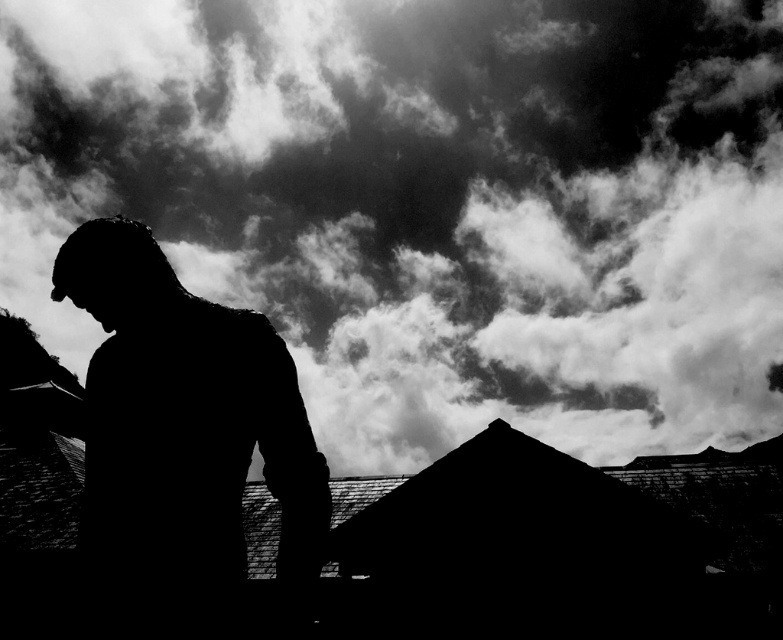
Does cloudy sky at upper center have a lesser height compared to black matte statue at center?

No, cloudy sky at upper center is not shorter than black matte statue at center.

Find the location of a particular element. cloudy sky at upper center is located at coordinates (430, 202).